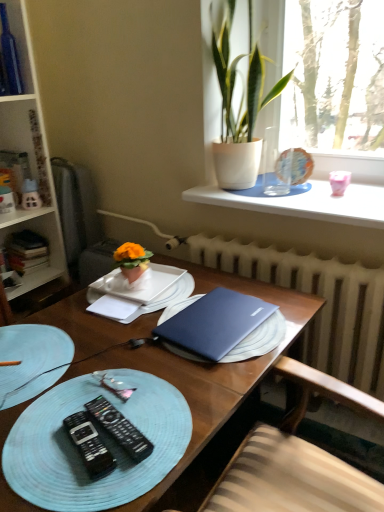
Find the location of a particular element. The height and width of the screenshot is (512, 384). space that is in front of matte glass globe at upper right, arranged as the 1th tableware when viewed from the back is located at coordinates (299, 190).